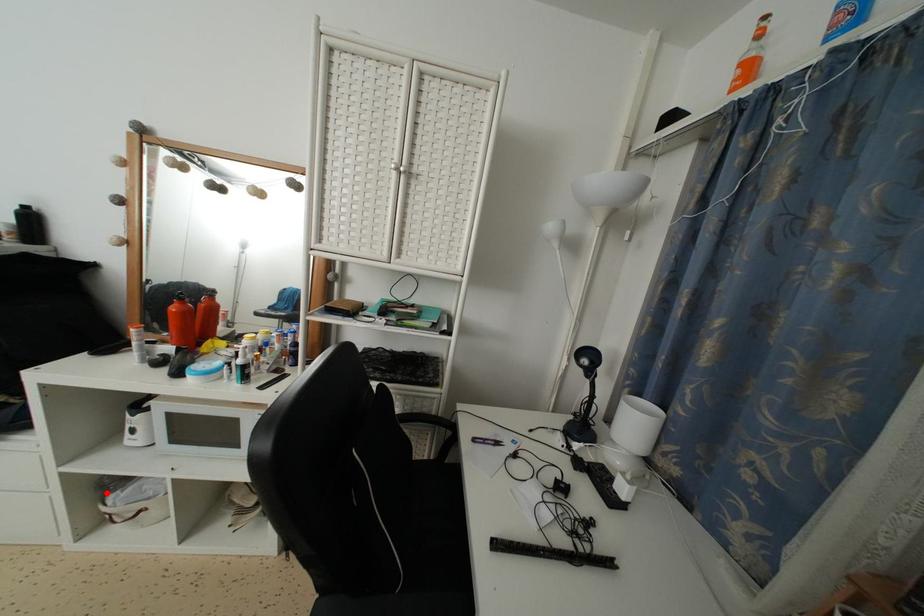
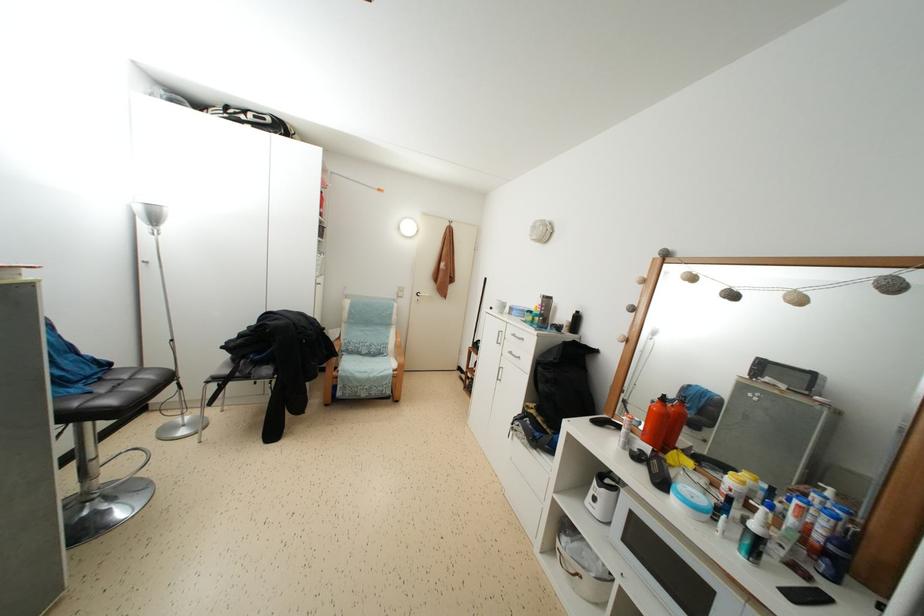
The point at the highlighted location is marked in the first image. Where is the corresponding point in the second image?

(566, 532)